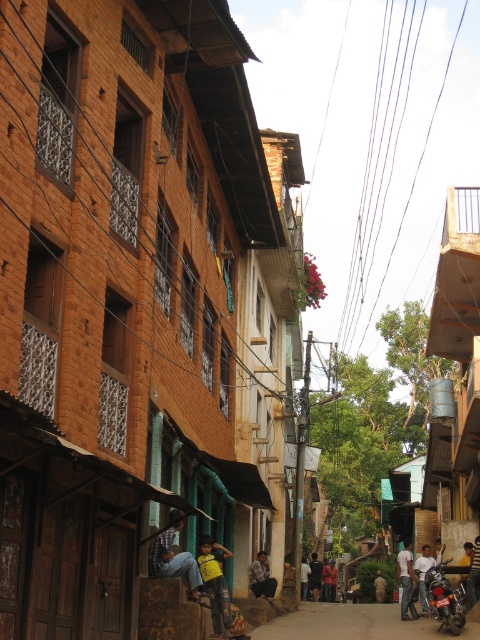
Can you confirm if denim jeans at center is wider than light blue jeans at center?

No, denim jeans at center is not wider than light blue jeans at center.

Measure the distance from denim jeans at center to light blue jeans at center.

denim jeans at center and light blue jeans at center are 28.11 meters apart.

Is point (194, 582) farther from viewer compared to point (397, 561)?

No, (194, 582) is in front of (397, 561).

The height and width of the screenshot is (640, 480). In order to click on denim jeans at center in this screenshot , I will do `click(173, 557)`.

This screenshot has height=640, width=480. Describe the element at coordinates (215, 582) in the screenshot. I see `yellow jersey at center` at that location.

Can you confirm if yellow jersey at center is smaller than dark blue shirt at center?

No, yellow jersey at center is not smaller than dark blue shirt at center.

This screenshot has height=640, width=480. What are the coordinates of `yellow jersey at center` in the screenshot? It's located at (215, 582).

Which of these two, yellow jersey at center or light blue jeans at center, stands taller?

light blue jeans at center is taller.

Is yellow jersey at center positioned at the back of light blue jeans at center?

No, it is not.

The height and width of the screenshot is (640, 480). What do you see at coordinates (215, 582) in the screenshot?
I see `yellow jersey at center` at bounding box center [215, 582].

I want to click on yellow jersey at center, so click(215, 582).